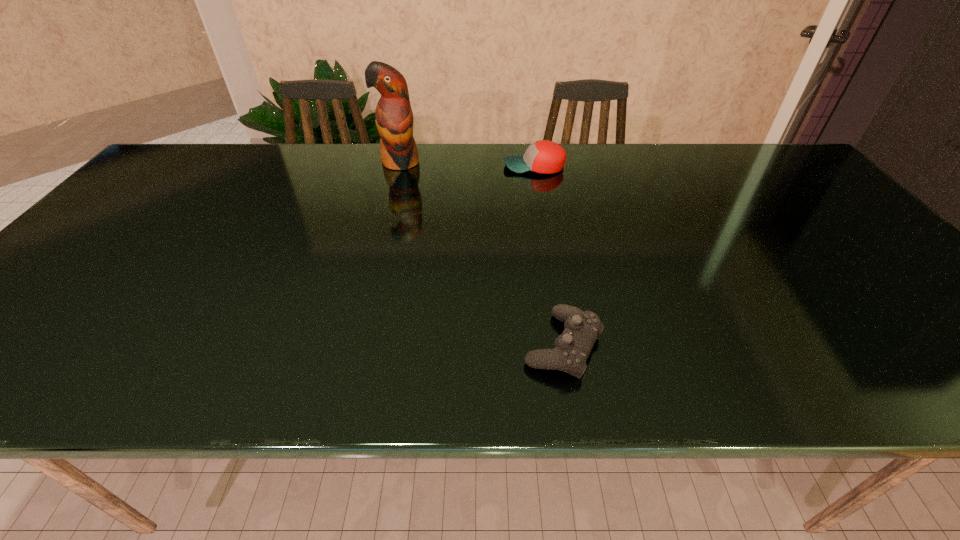
Where is `free space that satisfies the following two spatial constraints: 1. on the face of the nearest object; 2. on the right side of the tallest object`? The width and height of the screenshot is (960, 540). free space that satisfies the following two spatial constraints: 1. on the face of the nearest object; 2. on the right side of the tallest object is located at coordinates (353, 345).

Locate an element on the screen. free spot that satisfies the following two spatial constraints: 1. on the face of the leftmost object; 2. on the left side of the nearest object is located at coordinates (353, 345).

You are a GUI agent. You are given a task and a screenshot of the screen. Output one action in this format:
    pyautogui.click(x=<x>, y=<y>)
    Task: Click on the blank area in the image that satisfies the following two spatial constraints: 1. on the face of the nearest object; 2. on the right side of the tallest object
    Image resolution: width=960 pixels, height=540 pixels.
    Given the screenshot: What is the action you would take?
    pyautogui.click(x=353, y=345)